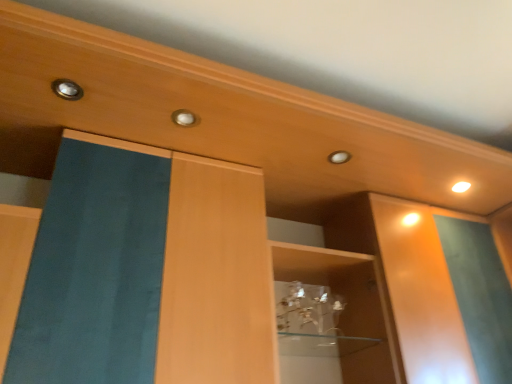
Question: Is matte gold knob at center, which is the first knob in back-to-front order, inside or outside of matte metallic knob at upper left, which is the first knob in front-to-back order?

Choices:
 (A) inside
 (B) outside

Answer: (B)

Question: Considering the positions of matte gold knob at center, which is the first knob in right-to-left order, and matte metallic knob at upper left, which is the first knob in front-to-back order, in the image, is matte gold knob at center, which is the first knob in right-to-left order, taller or shorter than matte metallic knob at upper left, which is the first knob in front-to-back order,?

Choices:
 (A) short
 (B) tall

Answer: (A)

Question: Estimate the real-world distances between objects in this image. Which object is closer to the white glossy light at upper right?

Choices:
 (A) matte metallic knob at upper left, marked as the 2th knob in a bottom-to-top arrangement
 (B) matte gold knob at center, which is counted as the second knob, starting from the left

Answer: (B)

Question: Which of these objects is positioned farthest from the matte gold knob at center, which is the first knob in right-to-left order?

Choices:
 (A) white glossy light at upper right
 (B) matte metallic knob at upper left, marked as the 2th knob in a bottom-to-top arrangement

Answer: (A)